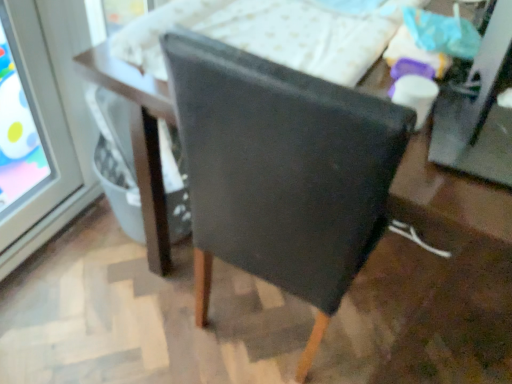
Question: Considering the relative sizes of matte black table at center and white textured mattress at upper center in the image provided, is matte black table at center bigger than white textured mattress at upper center?

Choices:
 (A) yes
 (B) no

Answer: (A)

Question: From the image's perspective, does matte black table at center appear lower than white textured mattress at upper center?

Choices:
 (A) yes
 (B) no

Answer: (A)

Question: Is matte black table at center positioned in front of white textured mattress at upper center?

Choices:
 (A) no
 (B) yes

Answer: (A)

Question: Is matte black table at center taller than white textured mattress at upper center?

Choices:
 (A) yes
 (B) no

Answer: (A)

Question: From a real-world perspective, is matte black table at center over white textured mattress at upper center?

Choices:
 (A) no
 (B) yes

Answer: (A)

Question: Does matte black table at center contain white textured mattress at upper center?

Choices:
 (A) yes
 (B) no

Answer: (B)

Question: Is the position of matte black chair at center less distant than that of white textured mattress at upper center?

Choices:
 (A) yes
 (B) no

Answer: (A)

Question: Is matte black chair at center looking in the opposite direction of white textured mattress at upper center?

Choices:
 (A) yes
 (B) no

Answer: (A)

Question: Can white textured mattress at upper center be found inside matte black chair at center?

Choices:
 (A) no
 (B) yes

Answer: (A)

Question: Can you confirm if matte black chair at center is shorter than white textured mattress at upper center?

Choices:
 (A) no
 (B) yes

Answer: (A)

Question: Does matte black chair at center appear on the left side of white textured mattress at upper center?

Choices:
 (A) yes
 (B) no

Answer: (B)

Question: From a real-world perspective, is matte black chair at center positioned under white textured mattress at upper center based on gravity?

Choices:
 (A) yes
 (B) no

Answer: (A)

Question: Is white textured mattress at upper center positioned far away from matte black chair at center?

Choices:
 (A) yes
 (B) no

Answer: (B)